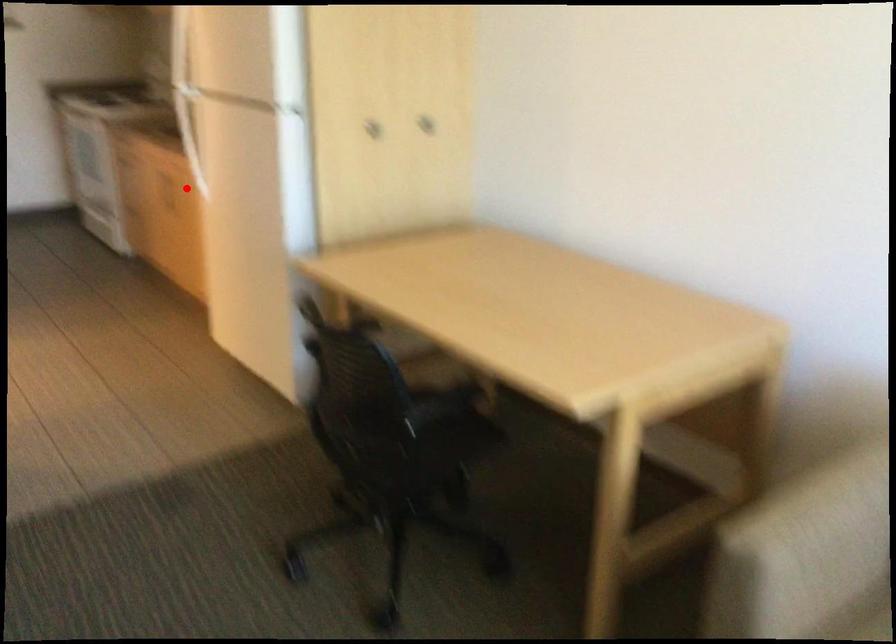
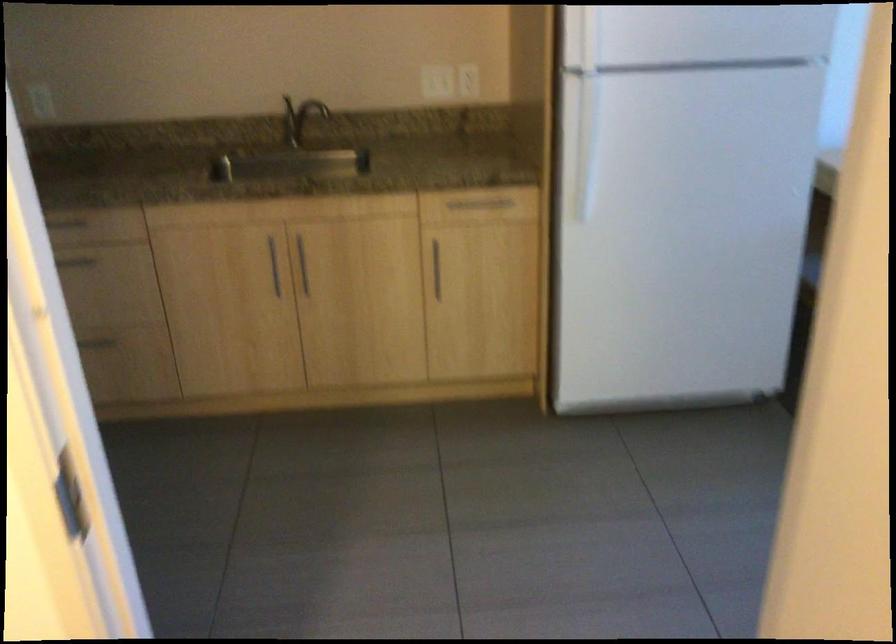
Question: A red point is marked in image1. In image2, is the corresponding 3D point closer to the camera or farther? Reply with the corresponding letter.

Choices:
 (A) The corresponding 3D point is closer.
 (B) The corresponding 3D point is farther.

Answer: (A)